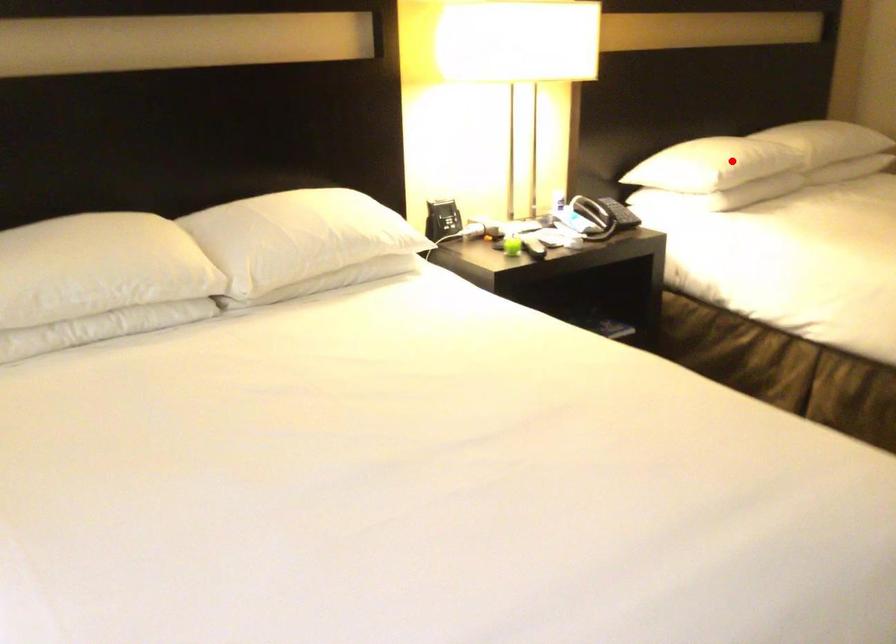
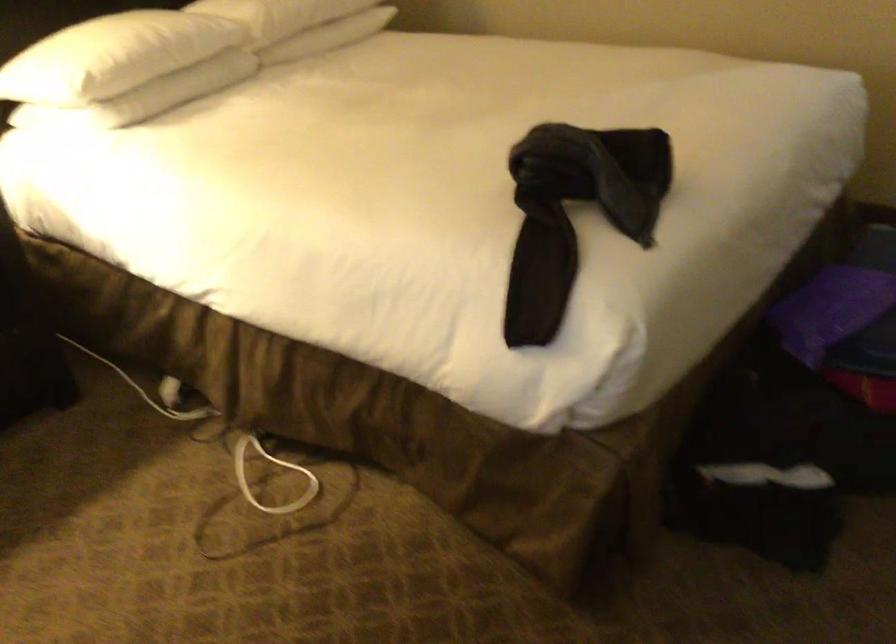
Locate, in the second image, the point that corresponds to the highlighted location in the first image.

(112, 57)